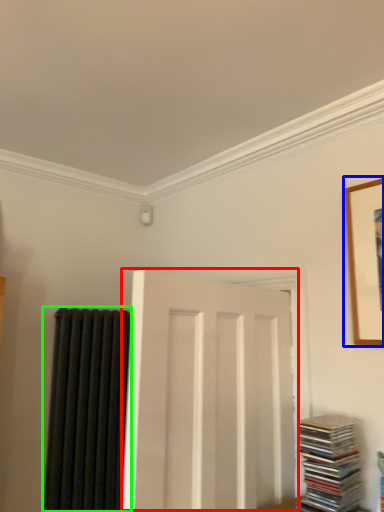
Question: Considering the real-world distances, which object is farthest from door (highlighted by a red box)? picture frame (highlighted by a blue box) or curtain (highlighted by a green box)?

Choices:
 (A) picture frame
 (B) curtain

Answer: (B)